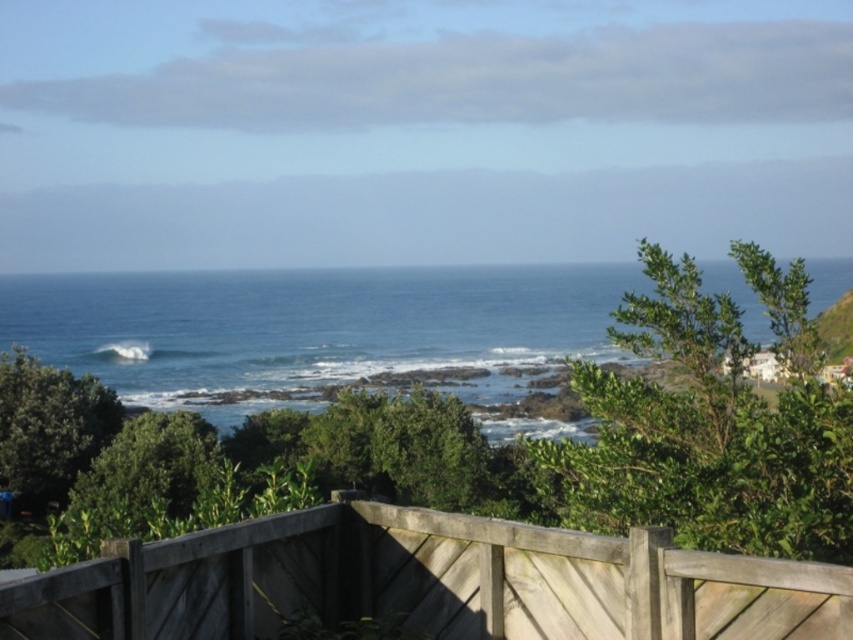
Who is lower down, wooden fence at lower center or white frothy wave at lower left?

white frothy wave at lower left is lower down.

Based on the photo, can you confirm if wooden fence at lower center is smaller than white frothy wave at lower left?

Yes.

Between point (256, 593) and point (123, 349), which one is positioned behind?

The point (123, 349) is more distant.

Image resolution: width=853 pixels, height=640 pixels. What are the coordinates of `wooden fence at lower center` in the screenshot? It's located at (426, 582).

Can you confirm if blue water at center is shorter than white frothy wave at lower left?

In fact, blue water at center may be taller than white frothy wave at lower left.

Who is higher up, blue water at center or white frothy wave at lower left?

blue water at center

Locate an element on the screen. Image resolution: width=853 pixels, height=640 pixels. blue water at center is located at coordinates (314, 328).

In the scene shown: Is wooden fence at lower center bigger than blue water at center?

No, wooden fence at lower center is not bigger than blue water at center.

Does wooden fence at lower center appear over blue water at center?

No.

This screenshot has height=640, width=853. I want to click on wooden fence at lower center, so click(x=426, y=582).